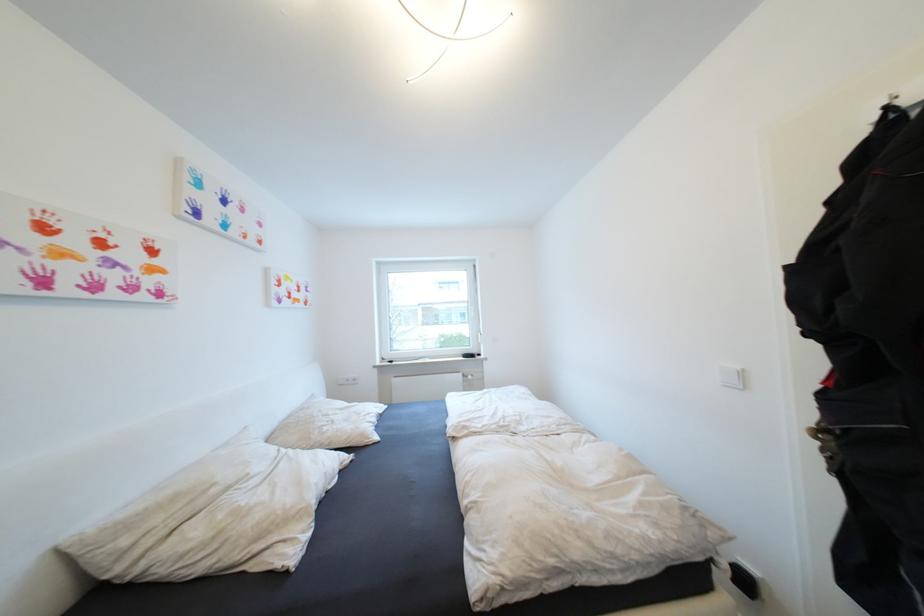
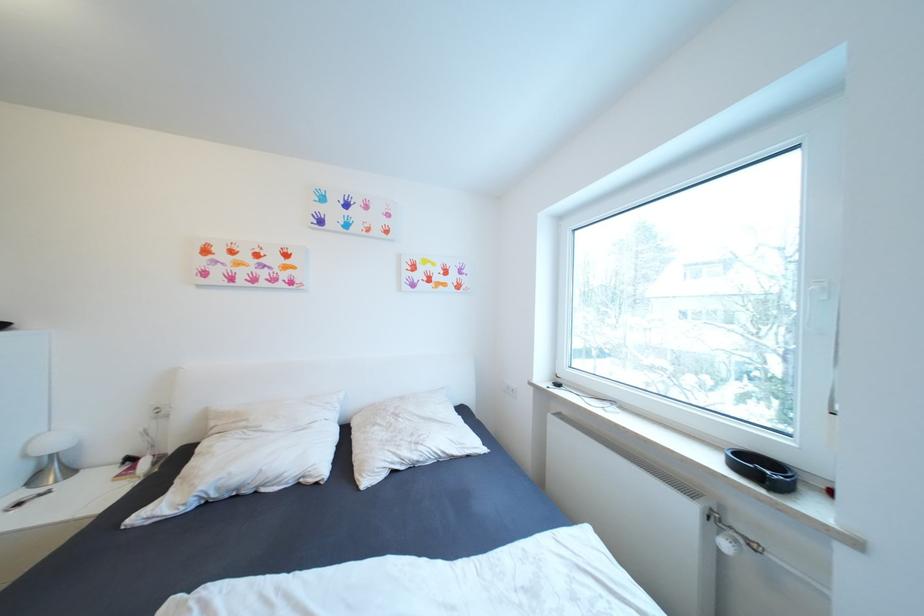
The point at (131, 543) is marked in the first image. Where is the corresponding point in the second image?

(220, 424)